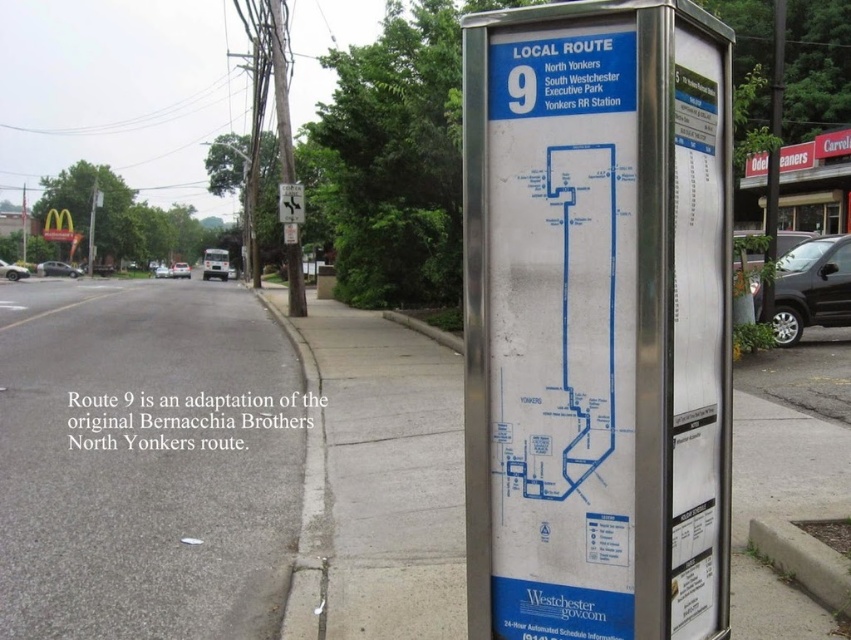
Question: Does silver metallic pavement at center lie in front of brushed metal pole at right?

Choices:
 (A) yes
 (B) no

Answer: (A)

Question: Is gray asphalt road at lower left bigger than brushed metal pole at right?

Choices:
 (A) no
 (B) yes

Answer: (A)

Question: Based on their relative distances, which object is nearer to the silver metallic pavement at center?

Choices:
 (A) silver metallic bus stop sign at center
 (B) gray asphalt road at lower left
 (C) brushed metal pole at right

Answer: (B)

Question: Among these points, which one is nearest to the camera?

Choices:
 (A) (6, 452)
 (B) (278, 209)
 (C) (780, 83)
 (D) (517, 220)

Answer: (D)

Question: Which point is farther to the camera?

Choices:
 (A) silver metallic bus stop sign at center
 (B) brushed metal pole at right
 (C) metallic silver street sign at upper center

Answer: (C)

Question: Observing the image, what is the correct spatial positioning of silver metallic pavement at center in reference to brushed metal pole at right?

Choices:
 (A) below
 (B) above

Answer: (A)